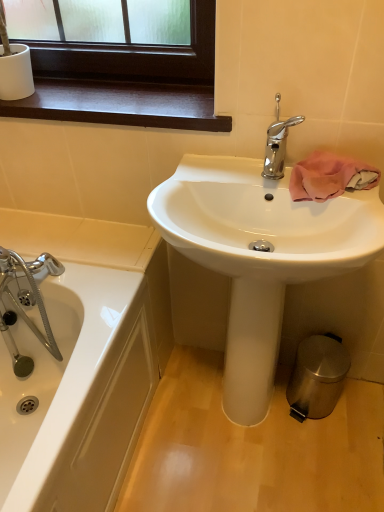
Identify the location of free region under white glossy sink at center (from a real-world perspective). The height and width of the screenshot is (512, 384). pyautogui.click(x=233, y=422).